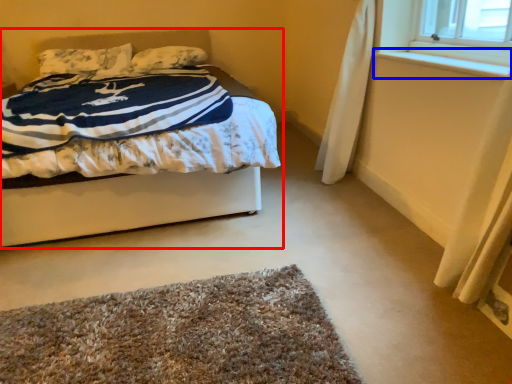
Question: Which object appears closest to the camera in this image, bed (highlighted by a red box) or window sill (highlighted by a blue box)?

Choices:
 (A) bed
 (B) window sill

Answer: (B)